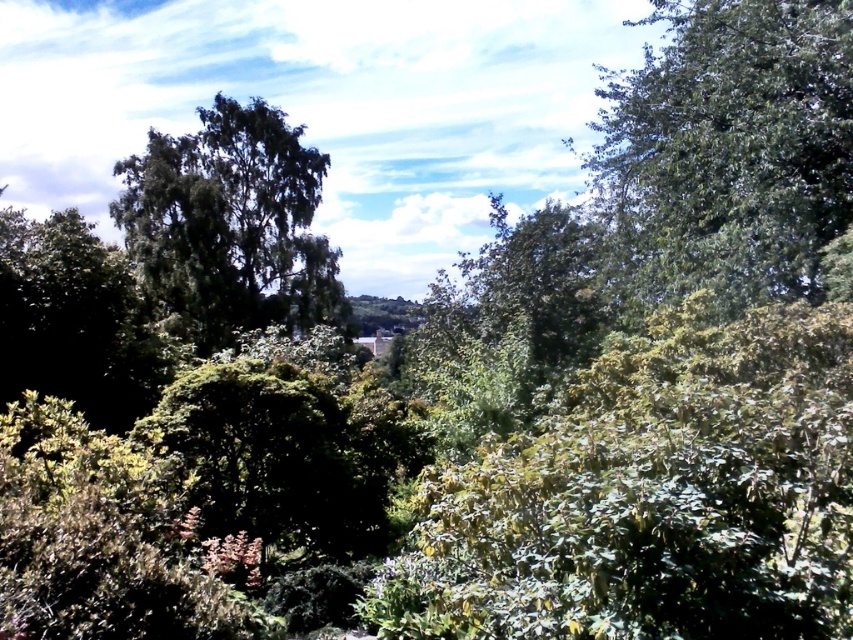
Question: Which of the following is the farthest from the observer?

Choices:
 (A) (618, 227)
 (B) (221, 218)

Answer: (B)

Question: Observing the image, what is the correct spatial positioning of green leafy tree at upper right in reference to green leafy tree at left?

Choices:
 (A) below
 (B) above

Answer: (B)

Question: Which of the following is the closest to the observer?

Choices:
 (A) green leafy tree at left
 (B) green leafy tree at upper right

Answer: (B)

Question: Can you confirm if green leafy tree at upper right is positioned below green leafy tree at left?

Choices:
 (A) yes
 (B) no

Answer: (B)

Question: Is green leafy tree at upper right to the right of green leafy tree at left from the viewer's perspective?

Choices:
 (A) yes
 (B) no

Answer: (A)

Question: Which point is closer to the camera taking this photo?

Choices:
 (A) (196, 250)
 (B) (837, 186)

Answer: (B)